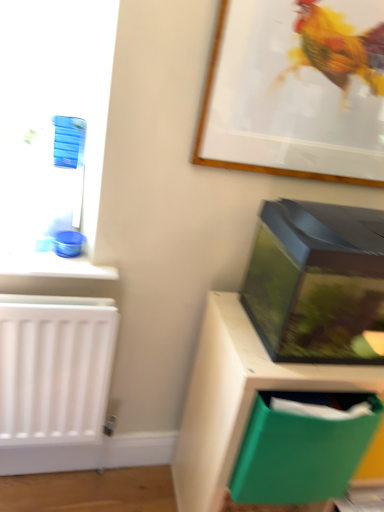
Question: From the image's perspective, is green plastic file at lower right located above transparent plastic aquarium at right?

Choices:
 (A) yes
 (B) no

Answer: (B)

Question: Is green plastic file at lower right facing away from transparent plastic aquarium at right?

Choices:
 (A) no
 (B) yes

Answer: (A)

Question: Is green plastic file at lower right completely or partially outside of transparent plastic aquarium at right?

Choices:
 (A) yes
 (B) no

Answer: (A)

Question: From a real-world perspective, is green plastic file at lower right beneath transparent plastic aquarium at right?

Choices:
 (A) no
 (B) yes

Answer: (B)

Question: Is green plastic file at lower right smaller than transparent plastic aquarium at right?

Choices:
 (A) yes
 (B) no

Answer: (B)

Question: Could you tell me if green plastic file at lower right is turned towards transparent plastic aquarium at right?

Choices:
 (A) no
 (B) yes

Answer: (A)

Question: Considering the relative sizes of green plastic file at lower right and green plastic folder at lower right in the image provided, is green plastic file at lower right smaller than green plastic folder at lower right?

Choices:
 (A) no
 (B) yes

Answer: (A)

Question: Is green plastic file at lower right not within green plastic folder at lower right?

Choices:
 (A) no
 (B) yes

Answer: (B)

Question: From the image's perspective, is green plastic file at lower right under green plastic folder at lower right?

Choices:
 (A) yes
 (B) no

Answer: (A)

Question: Does green plastic file at lower right come in front of green plastic folder at lower right?

Choices:
 (A) no
 (B) yes

Answer: (A)

Question: Does green plastic file at lower right have a greater height compared to green plastic folder at lower right?

Choices:
 (A) yes
 (B) no

Answer: (A)

Question: Can you confirm if green plastic file at lower right is positioned to the right of green plastic folder at lower right?

Choices:
 (A) no
 (B) yes

Answer: (B)

Question: From the image's perspective, would you say wooden picture frame at upper center is positioned over transparent plastic aquarium at right?

Choices:
 (A) no
 (B) yes

Answer: (B)